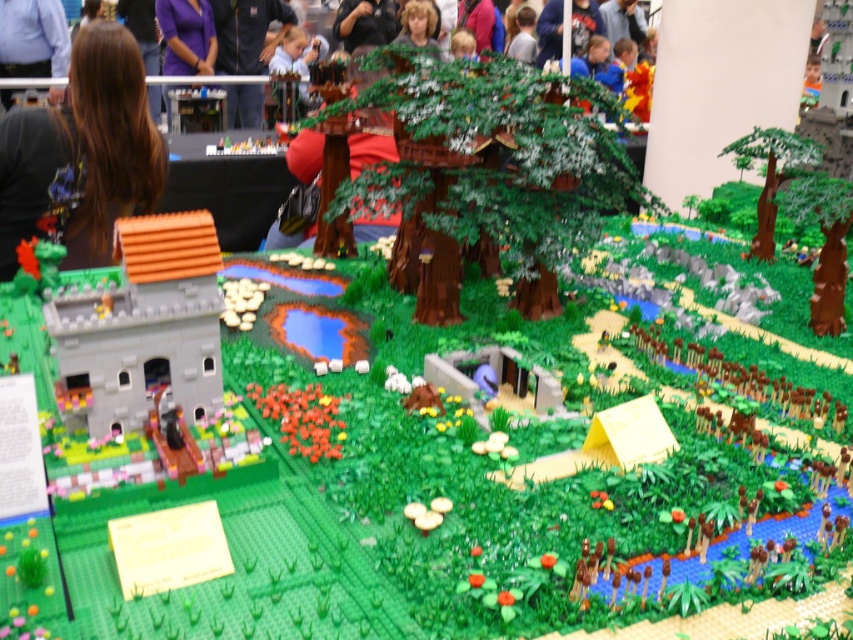
Image resolution: width=853 pixels, height=640 pixels. What do you see at coordinates (80, 154) in the screenshot?
I see `brown hair at upper left` at bounding box center [80, 154].

Where is `brown hair at upper left`? This screenshot has height=640, width=853. brown hair at upper left is located at coordinates (80, 154).

Is point (453, 244) farther from camera compared to point (807, 200)?

That is False.

This screenshot has height=640, width=853. What do you see at coordinates (490, 173) in the screenshot?
I see `green matte tree at center` at bounding box center [490, 173].

Image resolution: width=853 pixels, height=640 pixels. I want to click on green matte tree at center, so click(490, 173).

How distant is brown hair at upper left from brown textured tree at right?

A distance of 2.09 meters exists between brown hair at upper left and brown textured tree at right.

Which is in front, point (155, 145) or point (811, 314)?

Point (811, 314) is more forward.

Image resolution: width=853 pixels, height=640 pixels. What do you see at coordinates (80, 154) in the screenshot?
I see `brown hair at upper left` at bounding box center [80, 154].

Find the location of a particular element. brown hair at upper left is located at coordinates (80, 154).